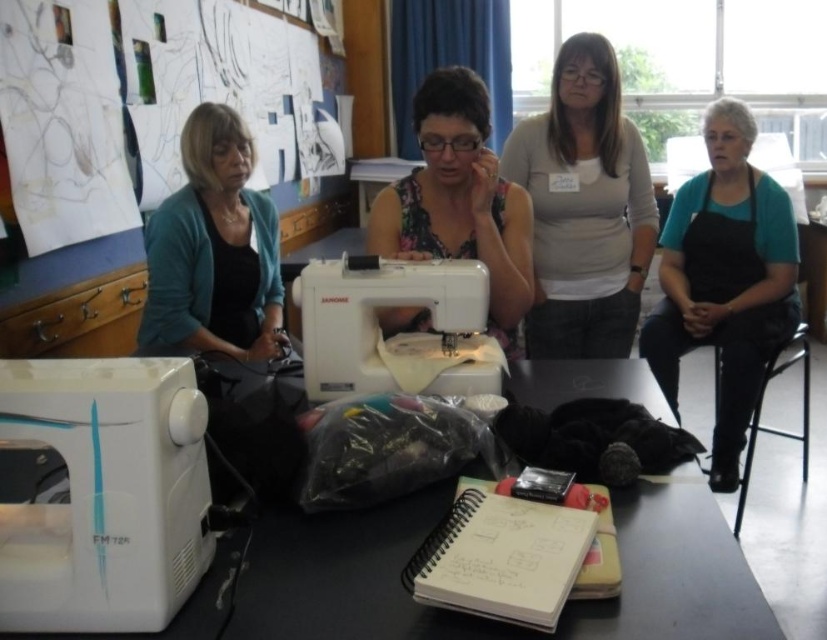
In the scene shown: You are a participant in this sewing workshop and need to choose between the teal fabric apron at right and the floral fabric at center for your project. Based on their positions, which fabric is closer to the edge of the table?

The teal fabric apron at right is taller than the floral fabric at center, meaning it is positioned closer to the edge of the table.

You are a student in the workshop and need to access both the teal fabric apron at right and the floral fabric at center. Which one is closer to you?

The teal fabric apron at right is closer to you because it is further to the viewer than the floral fabric at center.